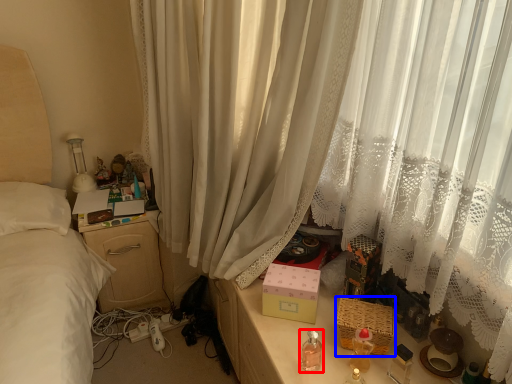
Question: Among these objects, which one is nearest to the camera, baby bottle (highlighted by a red box) or basket (highlighted by a blue box)?

Choices:
 (A) baby bottle
 (B) basket

Answer: (A)